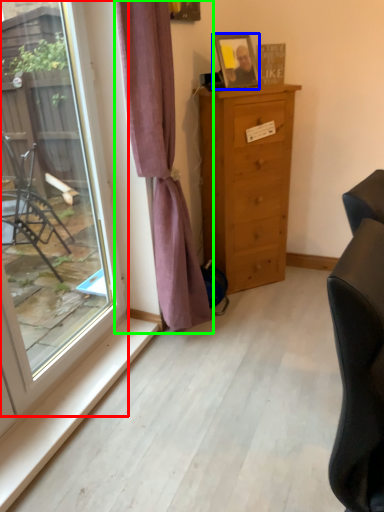
Question: Based on their relative distances, which object is nearer to window (highlighted by a red box)? Choose from picture frame (highlighted by a blue box) and curtain (highlighted by a green box).

Choices:
 (A) picture frame
 (B) curtain

Answer: (B)